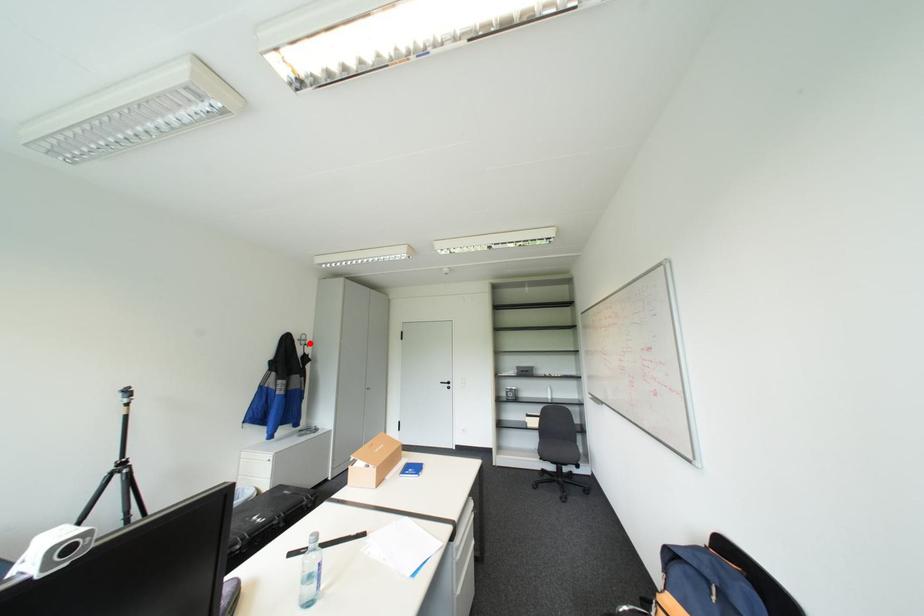
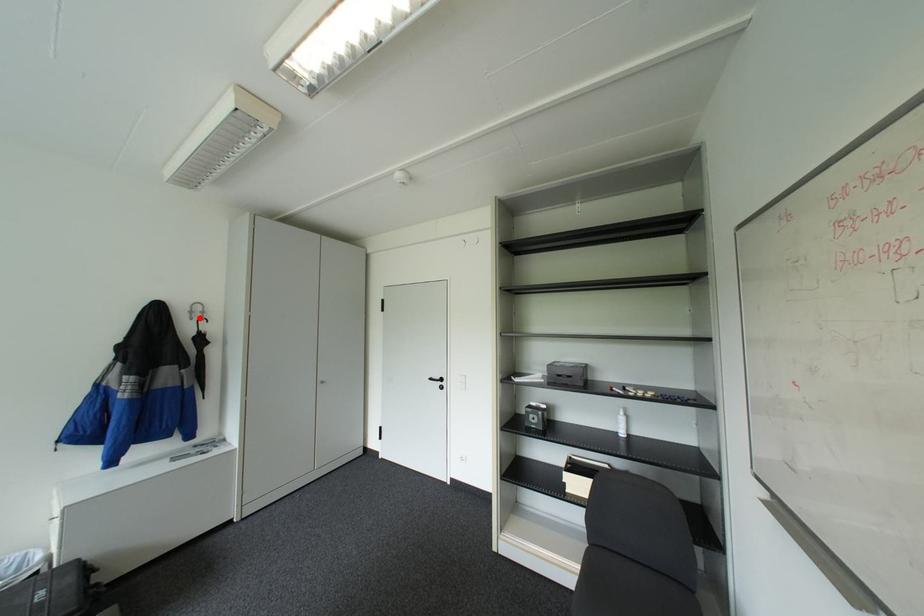
I am providing you with two images of the same scene from different viewpoints. A red point is marked on the first image and another point is marked on the second image. Does the point marked in image1 correspond to the same location as the one in image2?

Yes